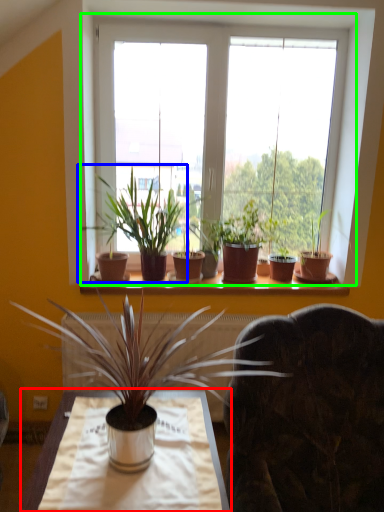
Question: Which is nearer to the table (highlighted by a red box)? houseplant (highlighted by a blue box) or window (highlighted by a green box).

Choices:
 (A) houseplant
 (B) window

Answer: (A)